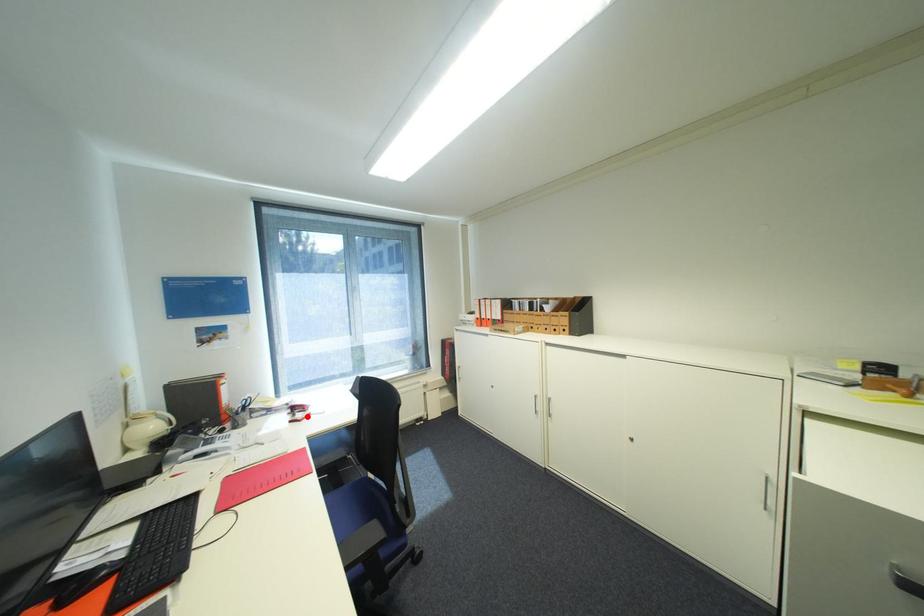
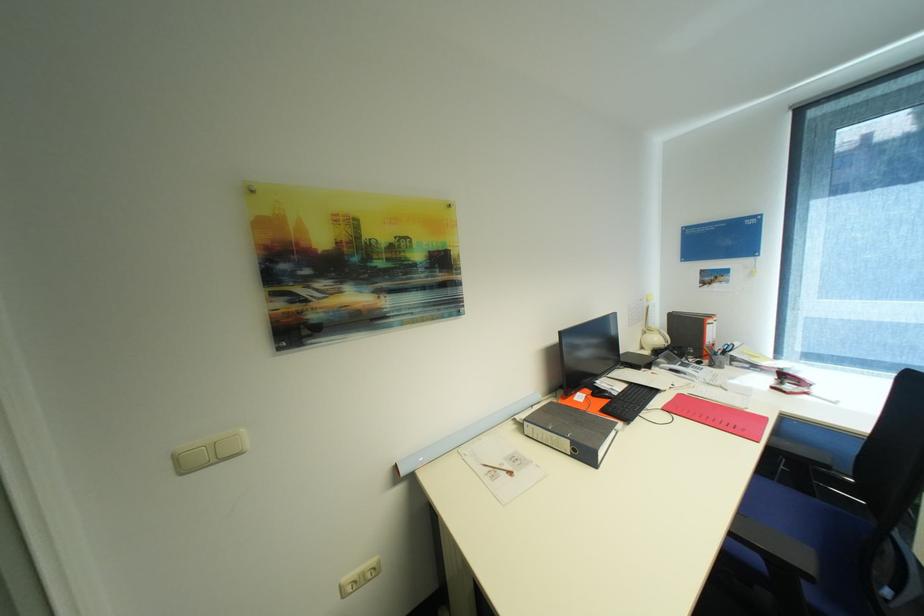
Question: I am providing you with two images of the same scene from different viewpoints. A red point is marked on the first image. Can you still see the location of the red point in image 2?

Choices:
 (A) Yes
 (B) No

Answer: (A)